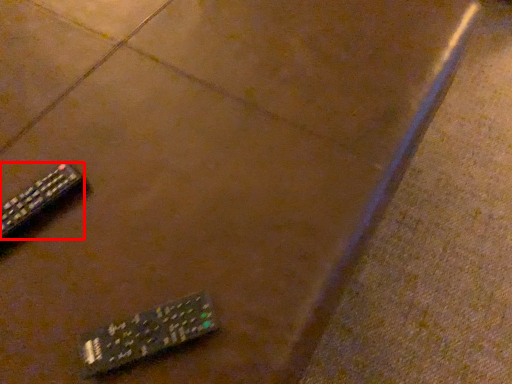
Question: From the image, what is the correct spatial relationship of remote control (annotated by the red box) in relation to remote control?

Choices:
 (A) right
 (B) left

Answer: (B)